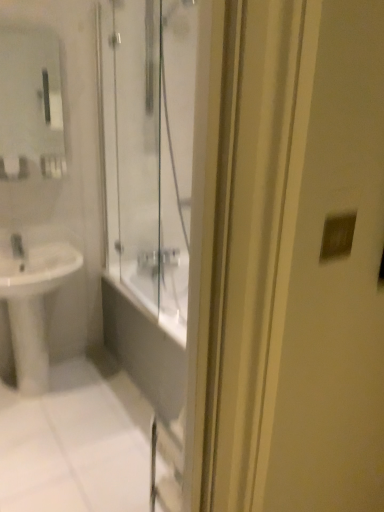
Question: Considering the positions of matte glass mirror at upper left and matte silver switch at upper right in the image, is matte glass mirror at upper left taller or shorter than matte silver switch at upper right?

Choices:
 (A) short
 (B) tall

Answer: (B)

Question: Considering their positions, is matte glass mirror at upper left located in front of or behind matte silver switch at upper right?

Choices:
 (A) behind
 (B) front

Answer: (A)

Question: Based on their relative distances, which object is farther from the matte glass mirror at upper left?

Choices:
 (A) matte silver switch at upper right
 (B) white glossy sink at lower left

Answer: (A)

Question: Considering the real-world distances, which object is farthest from the matte glass mirror at upper left?

Choices:
 (A) matte silver switch at upper right
 (B) white glossy sink at lower left

Answer: (A)